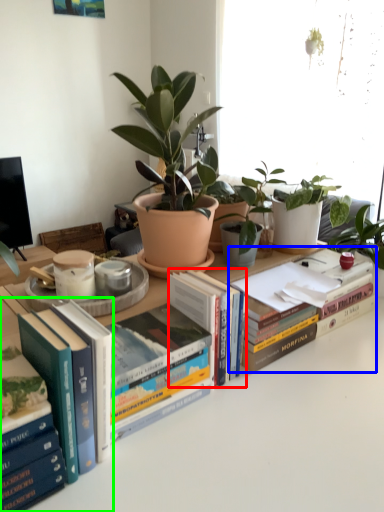
Question: Considering the real-world distances, which object is farthest from book (highlighted by a red box)? book (highlighted by a blue box) or book (highlighted by a green box)?

Choices:
 (A) book
 (B) book

Answer: (B)